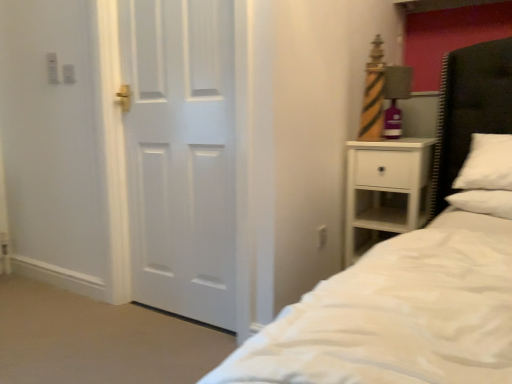
Question: Can you confirm if white matte nightstand at right is wider than white soft pillow at right?

Choices:
 (A) no
 (B) yes

Answer: (B)

Question: Is white matte nightstand at right touching white soft pillow at right?

Choices:
 (A) yes
 (B) no

Answer: (B)

Question: From the image's perspective, is white matte nightstand at right over white soft pillow at right?

Choices:
 (A) yes
 (B) no

Answer: (B)

Question: Can we say white matte nightstand at right lies outside white soft pillow at right?

Choices:
 (A) no
 (B) yes

Answer: (B)

Question: Can you confirm if white matte nightstand at right is taller than white soft pillow at right?

Choices:
 (A) no
 (B) yes

Answer: (B)

Question: Is the position of white matte nightstand at right less distant than that of white soft pillow at right?

Choices:
 (A) yes
 (B) no

Answer: (B)

Question: Does matte striped lamp at right appear on the right side of black leather headboard at right?

Choices:
 (A) no
 (B) yes

Answer: (A)

Question: From the image's perspective, would you say matte striped lamp at right is shown under black leather headboard at right?

Choices:
 (A) no
 (B) yes

Answer: (A)

Question: Can you confirm if matte striped lamp at right is positioned to the left of black leather headboard at right?

Choices:
 (A) no
 (B) yes

Answer: (B)

Question: Is matte striped lamp at right taller than black leather headboard at right?

Choices:
 (A) yes
 (B) no

Answer: (B)

Question: From a real-world perspective, is matte striped lamp at right on black leather headboard at right?

Choices:
 (A) no
 (B) yes

Answer: (B)

Question: Considering the relative positions of matte striped lamp at right and black leather headboard at right in the image provided, is matte striped lamp at right in front of black leather headboard at right?

Choices:
 (A) yes
 (B) no

Answer: (B)

Question: Can you confirm if white glossy door at left is shorter than matte striped lamp at right?

Choices:
 (A) yes
 (B) no

Answer: (B)